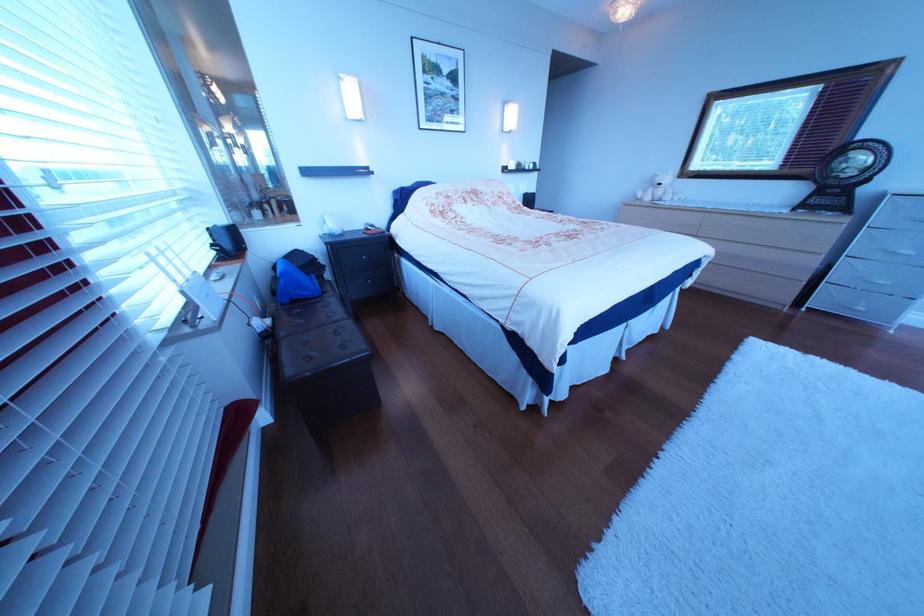
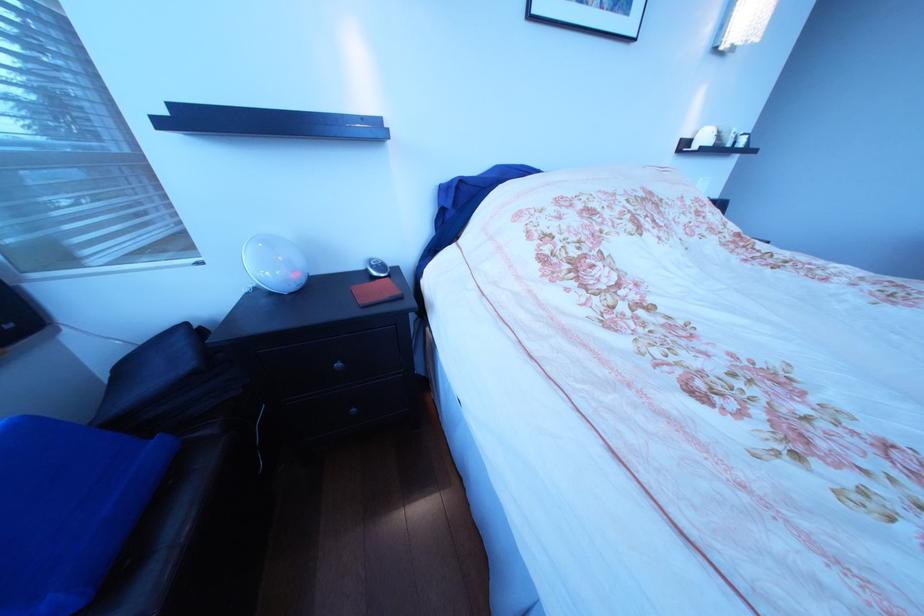
Where in the second image is the point corresponding to the point at 529,169 from the first image?

(724, 146)